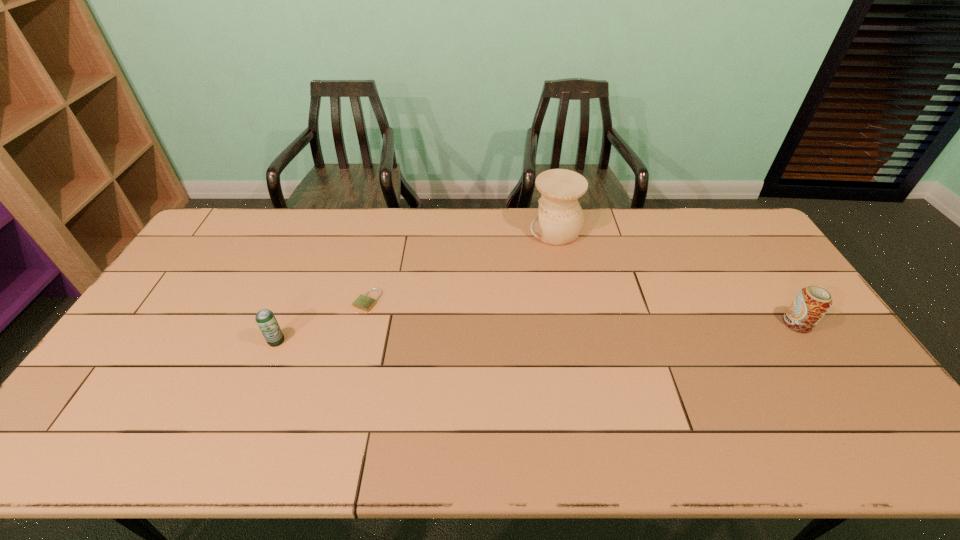
What are the coordinates of `free space at the far right corner` in the screenshot? It's located at (756, 244).

Find the location of a particular element. This screenshot has width=960, height=540. free space that is in between the third object from right to left and the tallest object is located at coordinates (462, 266).

Image resolution: width=960 pixels, height=540 pixels. Identify the location of free spot between the nearer beer can and the right beer can. (537, 332).

Find the location of a particular element. vacant space that's between the second farthest object and the pottery is located at coordinates tap(462, 266).

Identify the location of free space between the right beer can and the shortest object. (582, 312).

Find the location of a particular element. This screenshot has width=960, height=540. unoccupied position between the nearest object and the third farthest object is located at coordinates (537, 332).

This screenshot has height=540, width=960. What are the coordinates of `vacant area that lies between the rightmost object and the left beer can` in the screenshot? It's located at (537, 332).

Locate an element on the screen. empty space that is in between the shortest object and the farther beer can is located at coordinates pos(582,312).

I want to click on free spot between the farthest object and the right beer can, so click(x=676, y=277).

Locate an element on the screen. The image size is (960, 540). vacant space that is in between the left beer can and the third object from left to right is located at coordinates (416, 286).